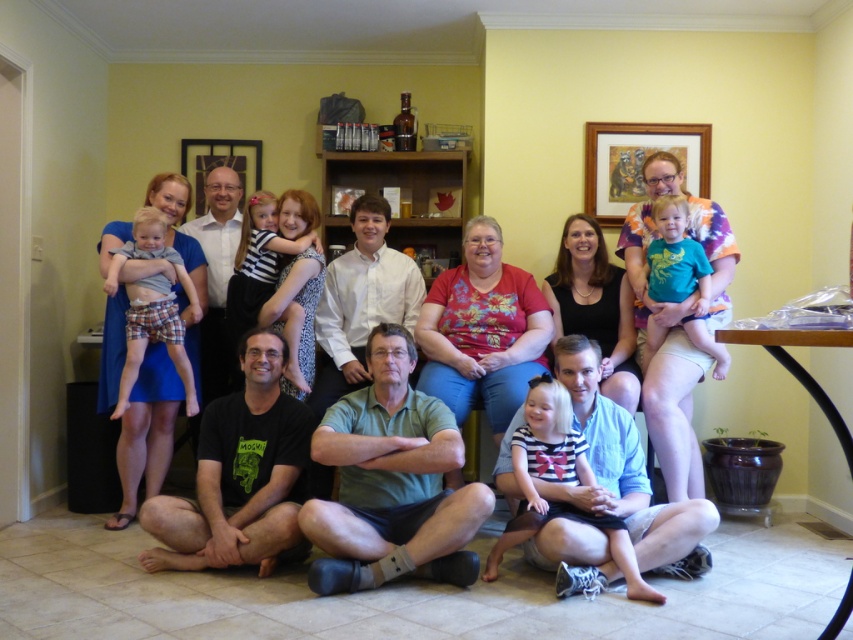
Between black t-shirt at lower center and wooden picture frame at upper center, which one is positioned higher?

Positioned higher is wooden picture frame at upper center.

Is point (234, 554) more distant than point (598, 156)?

No.

At what (x,y) coordinates should I click in order to perform the action: click on black t-shirt at lower center. Please return your answer as a coordinate pair (x, y). This screenshot has height=640, width=853. Looking at the image, I should click on (239, 476).

How much distance is there between floral fabric shirt at center and plaid fabric shorts at left?

A distance of 4.38 feet exists between floral fabric shirt at center and plaid fabric shorts at left.

Does floral fabric shirt at center come behind plaid fabric shorts at left?

No, floral fabric shirt at center is in front of plaid fabric shorts at left.

What do you see at coordinates (482, 330) in the screenshot?
I see `floral fabric shirt at center` at bounding box center [482, 330].

Find the location of a particular element. Image resolution: width=853 pixels, height=640 pixels. floral fabric shirt at center is located at coordinates (482, 330).

Between floral fabric shirt at center and striped cotton shirt at lower center, which one appears on the left side from the viewer's perspective?

Positioned to the left is floral fabric shirt at center.

Is floral fabric shirt at center further to camera compared to striped cotton shirt at lower center?

That is True.

What are the coordinates of `floral fabric shirt at center` in the screenshot? It's located at (482, 330).